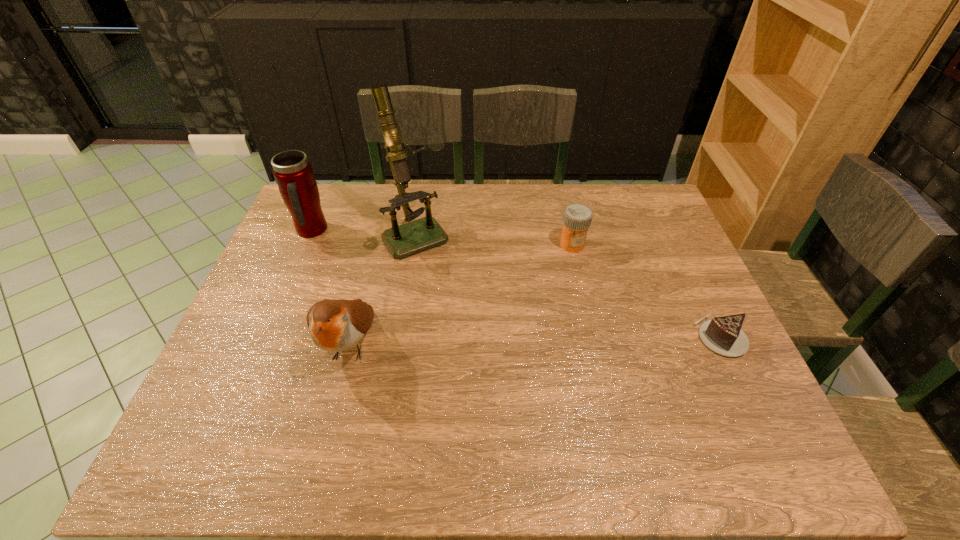
Find the location of a particular element. object that is at the near edge is located at coordinates (336, 325).

At what (x,y) coordinates should I click in order to perform the action: click on object located at the left edge. Please return your answer as a coordinate pair (x, y). Looking at the image, I should click on (293, 173).

Image resolution: width=960 pixels, height=540 pixels. Identify the location of object present at the right edge. (723, 335).

The height and width of the screenshot is (540, 960). Find the location of `object at the far left corner`. object at the far left corner is located at coordinates (293, 173).

Identify the location of free space at the far edge. (462, 198).

Find the location of a particular element. The width and height of the screenshot is (960, 540). free space at the near edge of the desktop is located at coordinates (324, 417).

You are a GUI agent. You are given a task and a screenshot of the screen. Output one action in this format:
    pyautogui.click(x=<x>, y=<y>)
    Task: Click on the vacant space at the left edge
    The height and width of the screenshot is (540, 960).
    Given the screenshot: What is the action you would take?
    pyautogui.click(x=288, y=264)

Locate an element on the screen. This screenshot has width=960, height=540. vacant space at the right edge of the desktop is located at coordinates (651, 230).

Locate an element on the screen. The image size is (960, 540). free space at the far left corner of the desktop is located at coordinates (333, 193).

Where is `vacant region at the far right corner of the desktop`? The width and height of the screenshot is (960, 540). vacant region at the far right corner of the desktop is located at coordinates (633, 219).